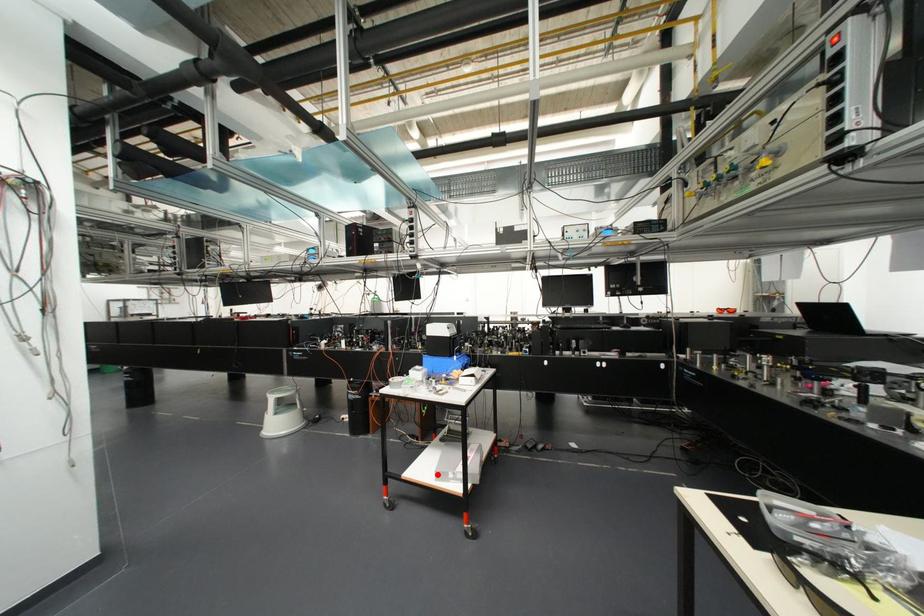
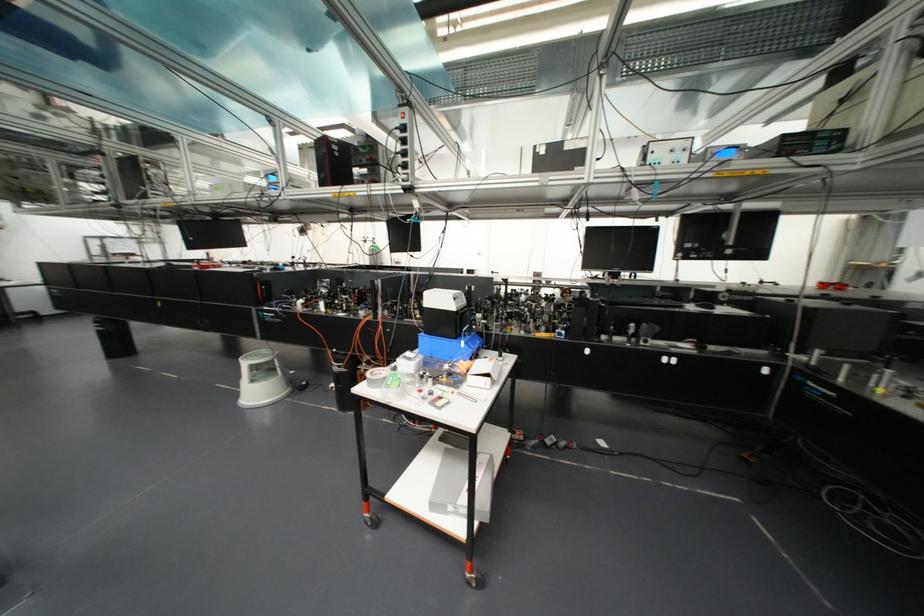
Where in the second image is the point corresponding to the highlighted location from the first image?

(432, 505)